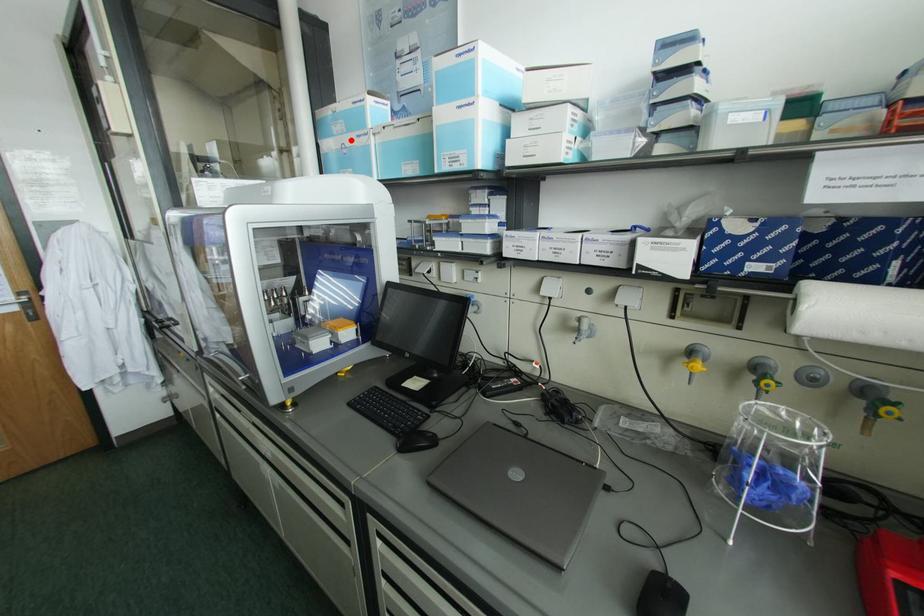
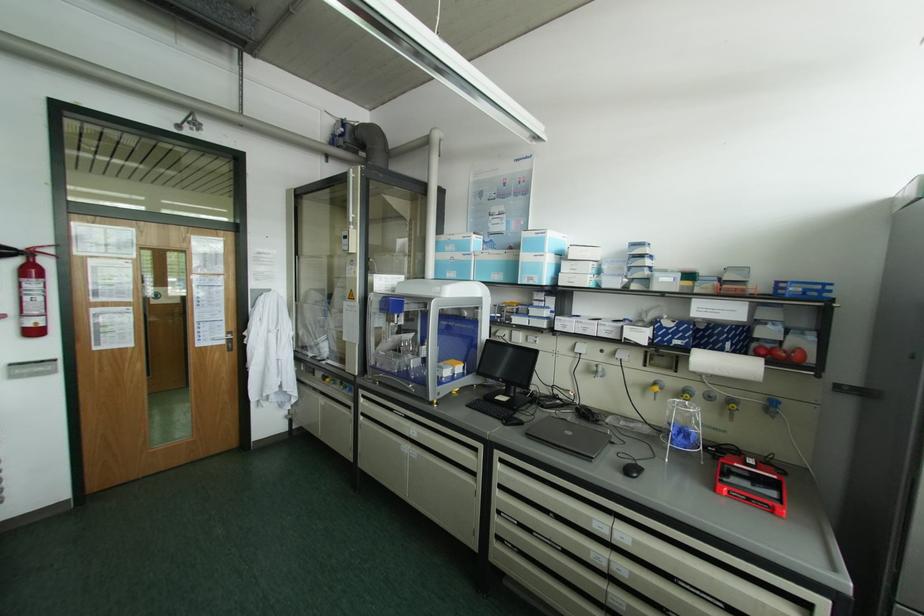
Question: I am providing you with two images of the same scene from different viewpoints. Image1 has a red point marked. In image2, the corresponding 3D location appears at what relative position? Reply with the corresponding letter.

Choices:
 (A) Closer
 (B) Farther

Answer: (B)